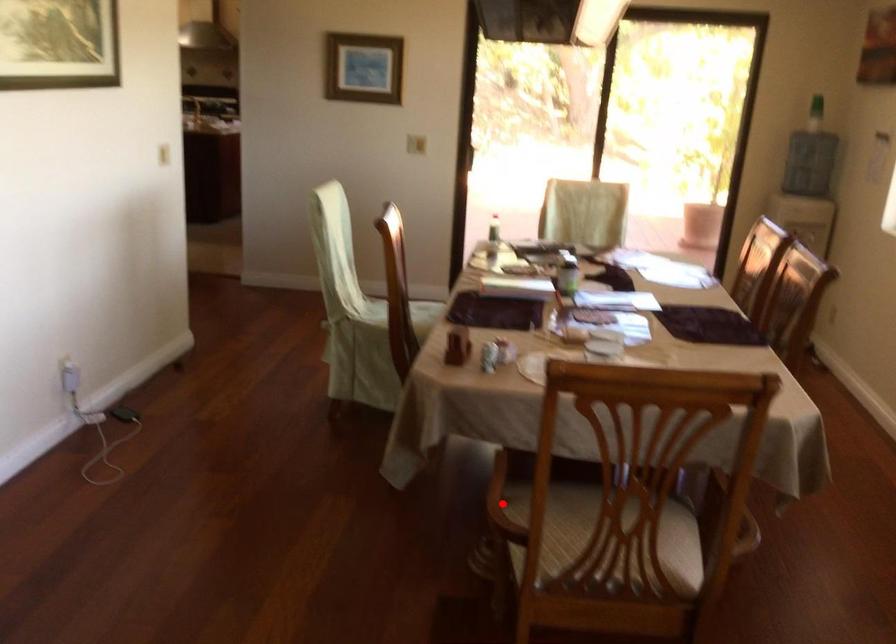
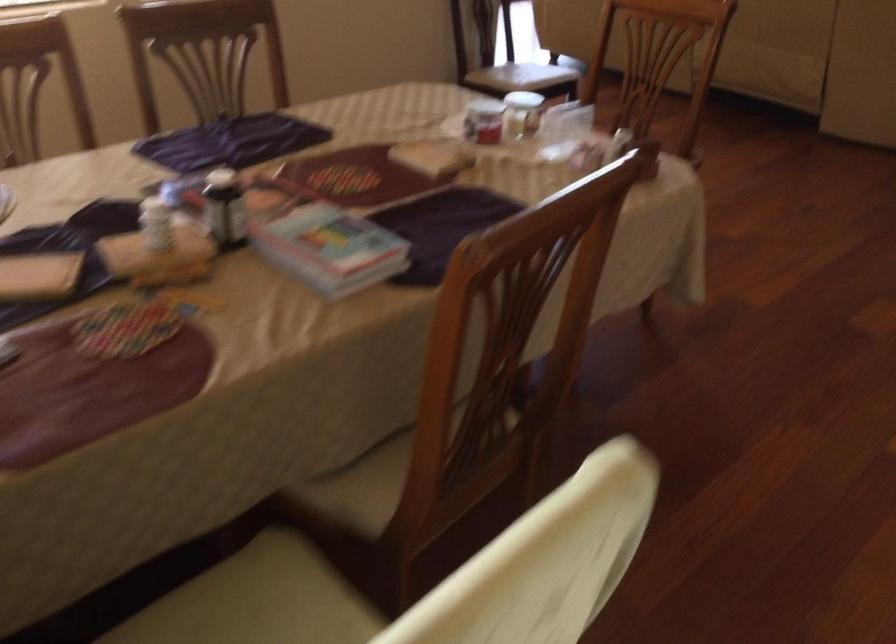
Question: I am providing you with two images of the same scene from different viewpoints. A red point is marked on the first image. Is the red point's position out of view in image 2?

Choices:
 (A) Yes
 (B) No

Answer: (A)